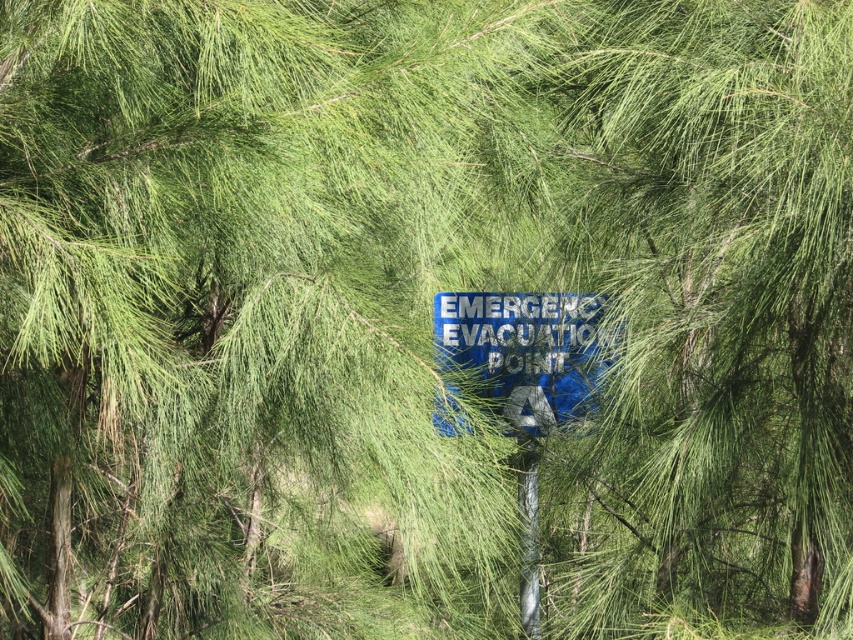
Is point (527, 342) positioned before point (527, 532)?

That is False.

Which of these two, blue plastic sign at center or metallic silver pole at center, stands shorter?

blue plastic sign at center is shorter.

Where is `blue plastic sign at center`? blue plastic sign at center is located at coordinates [x=523, y=353].

This screenshot has width=853, height=640. In order to click on blue plastic sign at center in this screenshot , I will do `click(523, 353)`.